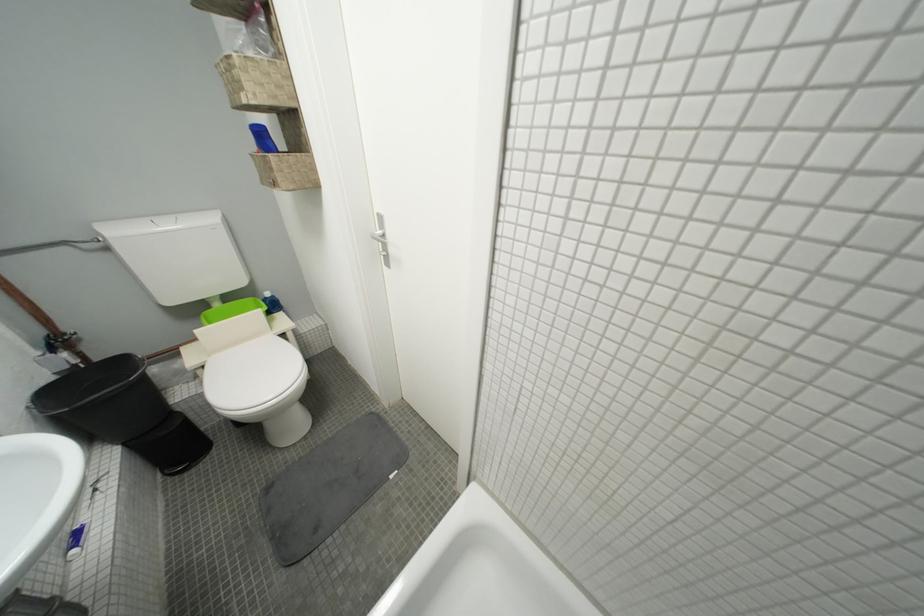
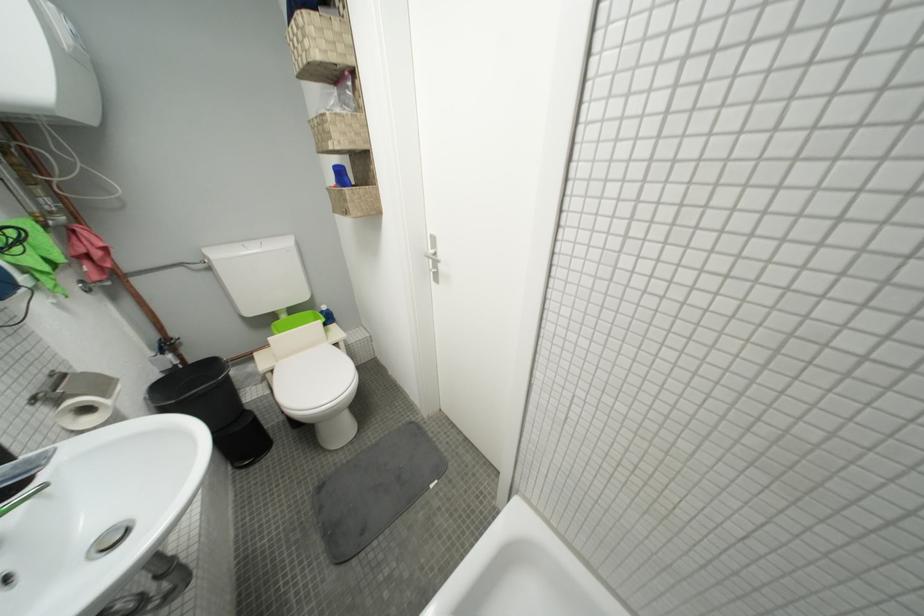
The point at (177, 229) is marked in the first image. Where is the corresponding point in the second image?

(262, 252)